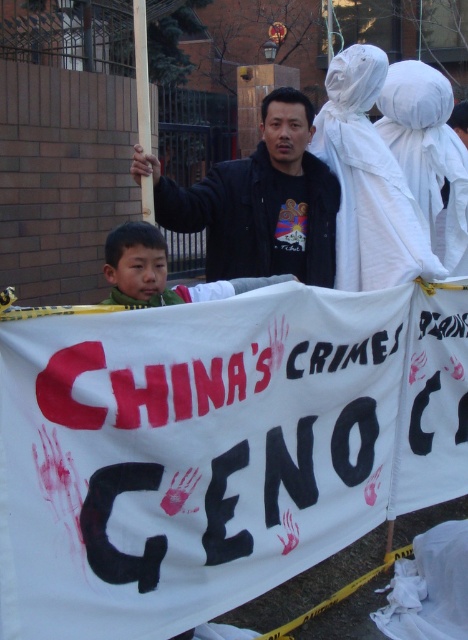
You are a photographer at the protest scene. You want to take a photo of both the black matte jacket at center and the green fuzzy jacket at center. Which jacket should you focus on first to ensure both are in the frame?

You should focus on the black matte jacket at center first because it is closer to you than the green fuzzy jacket at center, ensuring both are in the frame.

What is located at the coordinates point (257, 198) in the image?

The black matte jacket at center is located at point (257, 198).

What are the coordinates of the black matte jacket at center in the image?

The coordinates of the black matte jacket at center are at point (257, 198).